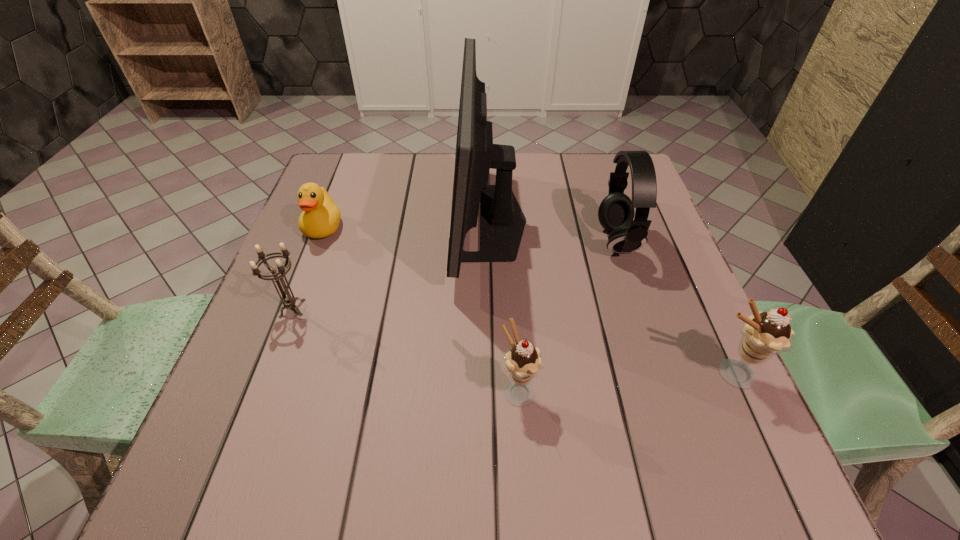
Find the location of `free spot between the duck and the candle holder`. free spot between the duck and the candle holder is located at coordinates (308, 268).

Identify the location of vacant space in between the shorter icecream and the fifth object from left to right. (568, 316).

At what (x,y) coordinates should I click in order to perform the action: click on vacant region between the duck and the candle holder. Please return your answer as a coordinate pair (x, y). Looking at the image, I should click on (308, 268).

I want to click on unoccupied position between the computer monitor and the left icecream, so click(x=504, y=306).

Where is `empty location between the taller icecream and the computer monitor`? The width and height of the screenshot is (960, 540). empty location between the taller icecream and the computer monitor is located at coordinates (610, 298).

You are a GUI agent. You are given a task and a screenshot of the screen. Output one action in this format:
    pyautogui.click(x=<x>, y=<y>)
    Task: Click on the free point between the duck and the shorter icecream
    
    Given the screenshot: What is the action you would take?
    pyautogui.click(x=421, y=309)

I want to click on the fifth closest object to the fifth object from left to right, so click(289, 301).

Locate which object ranks fifth in proximity to the duck. Please provide its 2D coordinates. Your answer should be formatted as a tuple, i.e. [(x, y)], where the tuple contains the x and y coordinates of a point satisfying the conditions above.

[(764, 334)]

Where is `vacant space that satisfies the following two spatial constraints: 1. on the ear cups of the earphone; 2. on the left side of the rightmost object`? The height and width of the screenshot is (540, 960). vacant space that satisfies the following two spatial constraints: 1. on the ear cups of the earphone; 2. on the left side of the rightmost object is located at coordinates (660, 374).

Identify the location of free region that satisfies the following two spatial constraints: 1. on the screen side of the computer monitor; 2. on the front side of the candle holder. coord(492,308).